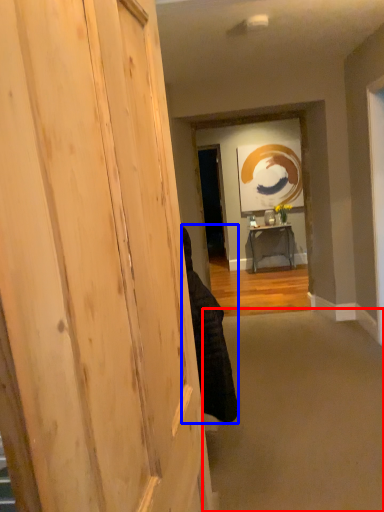
Question: Among these objects, which one is farthest to the camera, plain (highlighted by a red box) or person (highlighted by a blue box)?

Choices:
 (A) plain
 (B) person

Answer: (B)